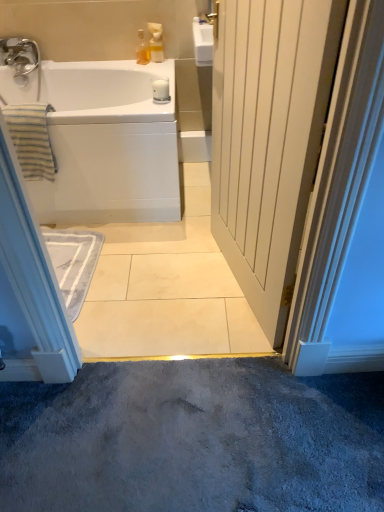
Locate an element on the screen. The height and width of the screenshot is (512, 384). vacant space to the left of white glossy soap dispenser at upper center, which is the first toiletry in right-to-left order is located at coordinates (130, 64).